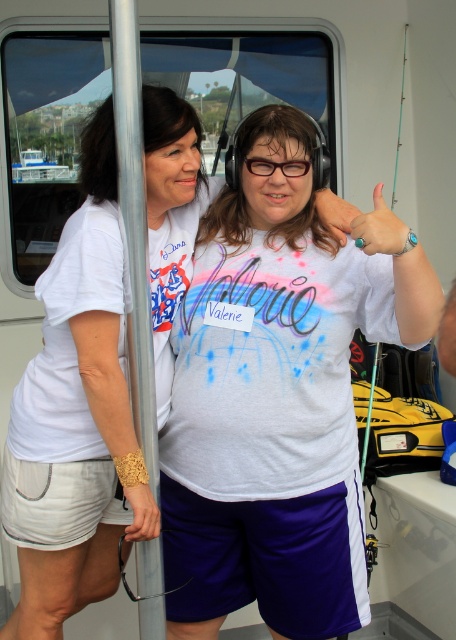
Question: Does white matte t-shirt at center appear on the left side of white plastic boat at upper left?

Choices:
 (A) yes
 (B) no

Answer: (B)

Question: Which point is closer to the camera taking this photo?

Choices:
 (A) (192, 586)
 (B) (356, 300)

Answer: (B)

Question: Among these points, which one is farthest from the camera?

Choices:
 (A) (371, 237)
 (B) (88, 436)

Answer: (B)

Question: Can you confirm if teal painted fingernails at upper center is bigger than white plastic boat at upper left?

Choices:
 (A) no
 (B) yes

Answer: (B)

Question: Which point is closer to the camera taking this photo?

Choices:
 (A) (118, 337)
 (B) (359, 492)
 (C) (328, 189)

Answer: (A)

Question: Is white fabric shirt at center below white plastic boat at upper left?

Choices:
 (A) no
 (B) yes

Answer: (B)